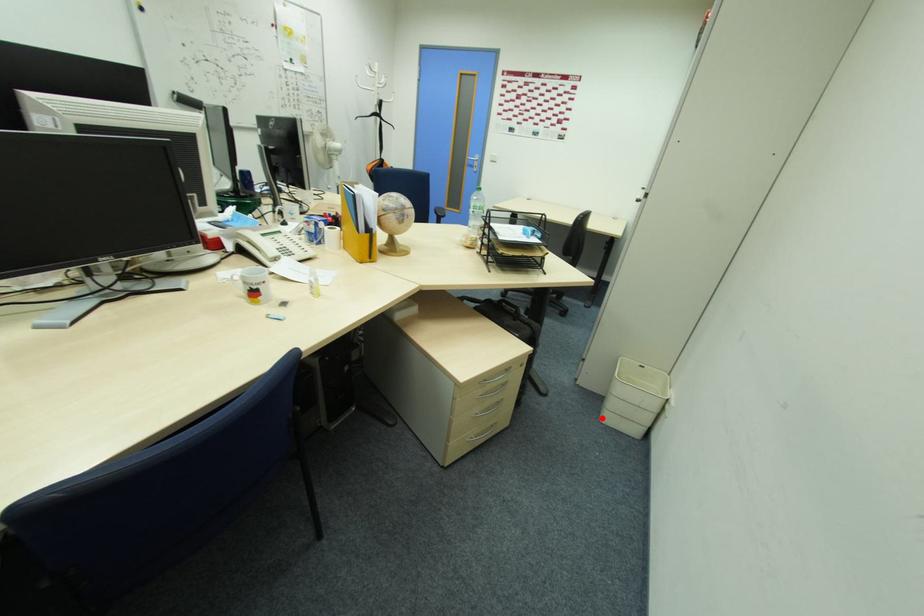
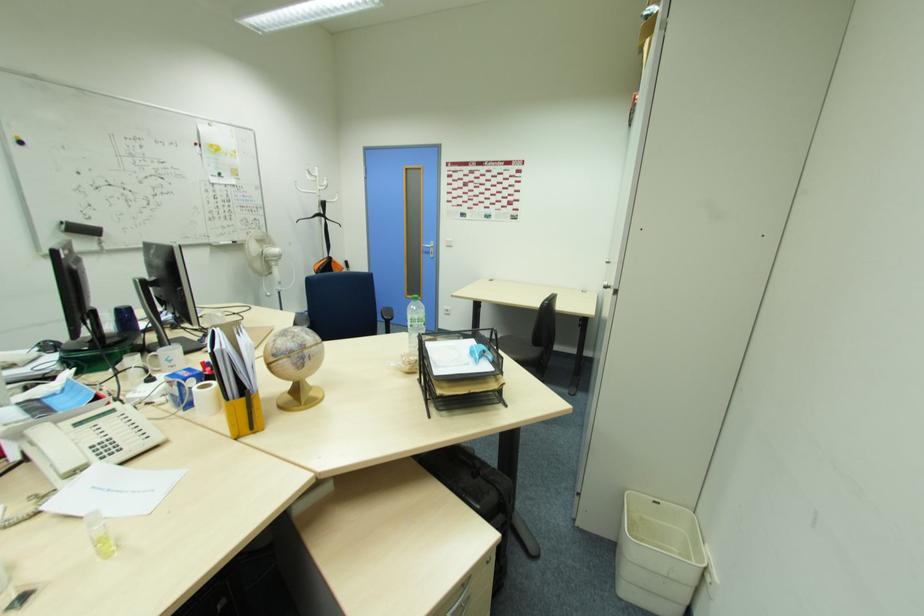
Question: A red point is marked in image1. In image2, is the corresponding 3D point closer to the camera or farther? Reply with the corresponding letter.

Choices:
 (A) The corresponding 3D point is closer.
 (B) The corresponding 3D point is farther.

Answer: (B)